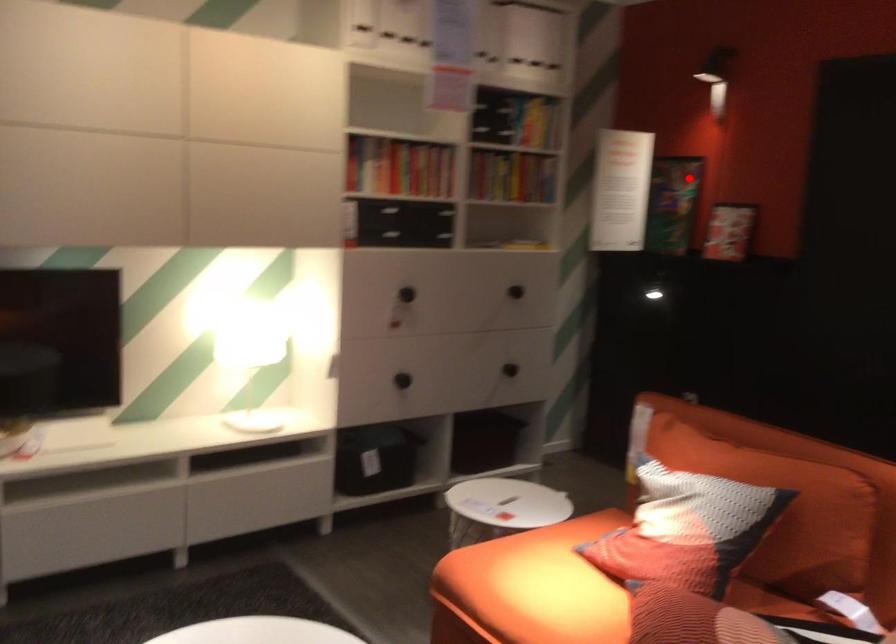
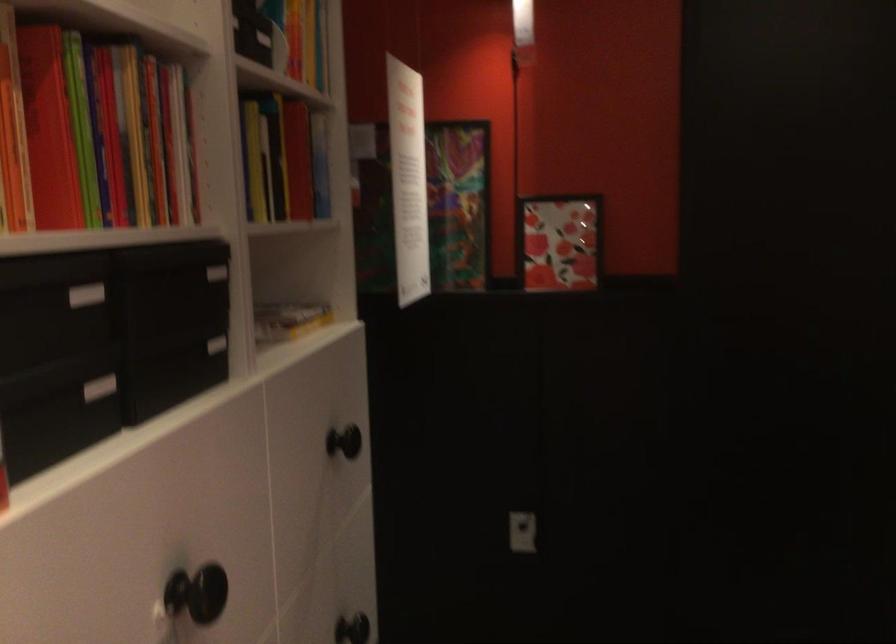
In the second image, find the point that corresponds to the highlighted location in the first image.

(458, 204)